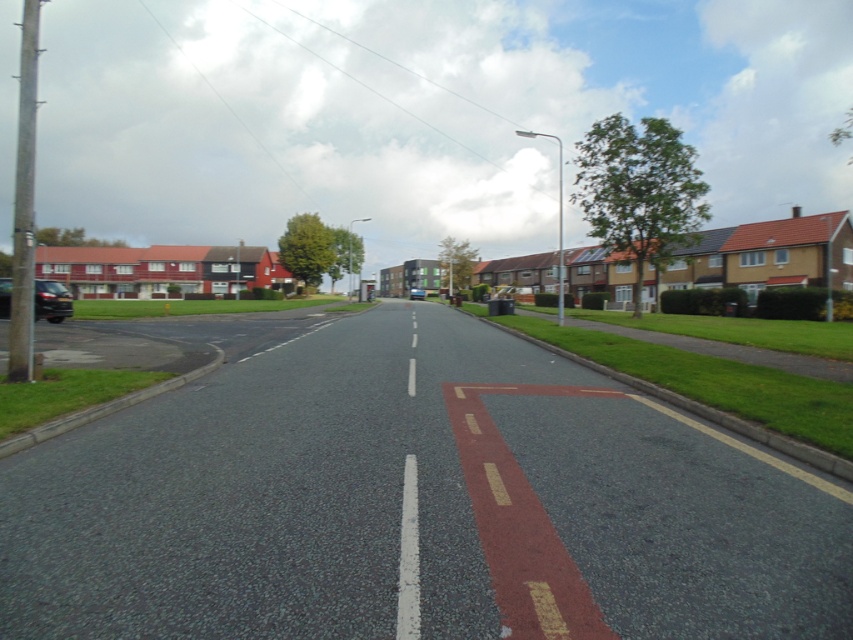
Question: Is shiny black car at left bigger than matte black car at center?

Choices:
 (A) yes
 (B) no

Answer: (A)

Question: Which point is closer to the camera?

Choices:
 (A) (412, 288)
 (B) (47, 289)

Answer: (B)

Question: Can you confirm if shiny black car at left is smaller than matte black car at center?

Choices:
 (A) yes
 (B) no

Answer: (B)

Question: Is shiny black car at left to the left of matte black car at center from the viewer's perspective?

Choices:
 (A) yes
 (B) no

Answer: (A)

Question: Which of the following is the closest to the observer?

Choices:
 (A) (418, 288)
 (B) (50, 316)

Answer: (B)